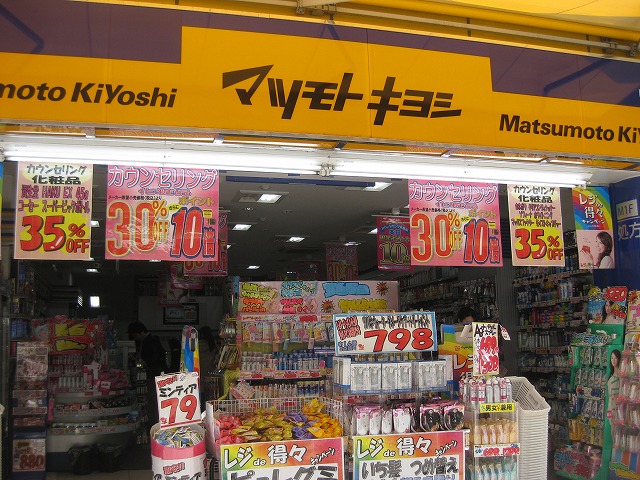
Where is `trash bag`? The height and width of the screenshot is (480, 640). trash bag is located at coordinates (115, 442), (84, 450).